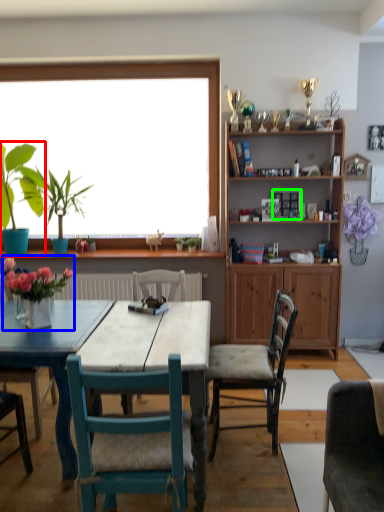
Question: Based on their relative distances, which object is nearer to houseplant (highlighted by a red box)? Choose from floral arrangement (highlighted by a blue box) and picture frame (highlighted by a green box).

Choices:
 (A) floral arrangement
 (B) picture frame

Answer: (A)